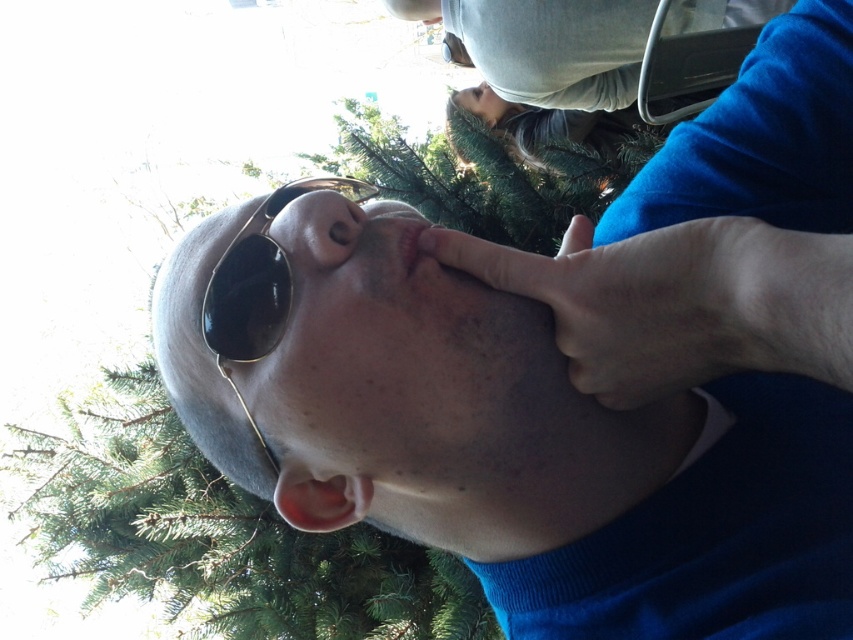
Question: Which point appears farthest from the camera in this image?

Choices:
 (A) (310, 225)
 (B) (811, 236)
 (C) (276, 280)
 (D) (397, 246)

Answer: (C)

Question: Which point is closer to the camera?

Choices:
 (A) (148, 488)
 (B) (589, 358)
 (C) (303, 204)

Answer: (B)

Question: Is black metallic goggles at center to the right of pink matte lips at center from the viewer's perspective?

Choices:
 (A) no
 (B) yes

Answer: (A)

Question: Can you confirm if matte black sunglasses at center is positioned to the left of black metallic goggles at center?

Choices:
 (A) no
 (B) yes

Answer: (B)

Question: Among these objects, which one is farthest from the camera?

Choices:
 (A) pink matte lips at center
 (B) smooth skin hand at center
 (C) matte black nose at center
 (D) matte black sunglasses at center

Answer: (C)

Question: Is black metallic goggles at center below matte black nose at center?

Choices:
 (A) yes
 (B) no

Answer: (A)